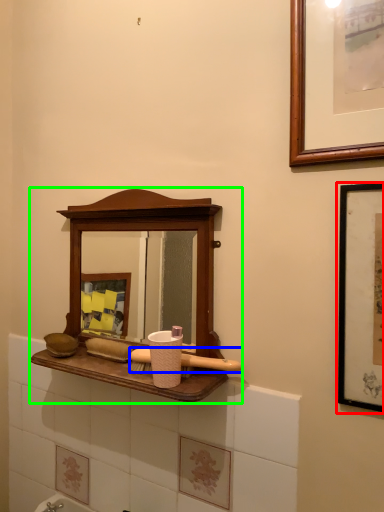
Question: Which object is the closest to the picture frame (highlighted by a red box)? Choose among these: brush (highlighted by a blue box) or medicine cabinet (highlighted by a green box).

Choices:
 (A) brush
 (B) medicine cabinet

Answer: (A)